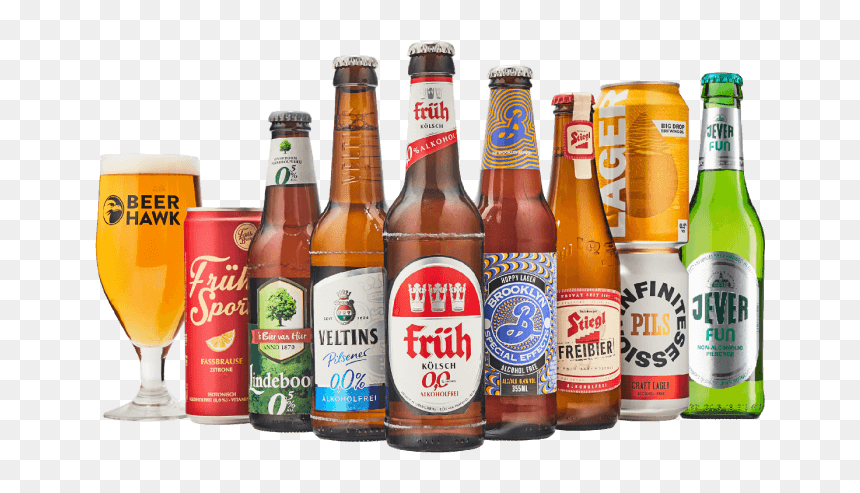
Image resolution: width=860 pixels, height=493 pixels. Find the location of `bottles of beer`. bottles of beer is located at coordinates (278, 342), (347, 346), (438, 348), (521, 347), (587, 343), (717, 317).